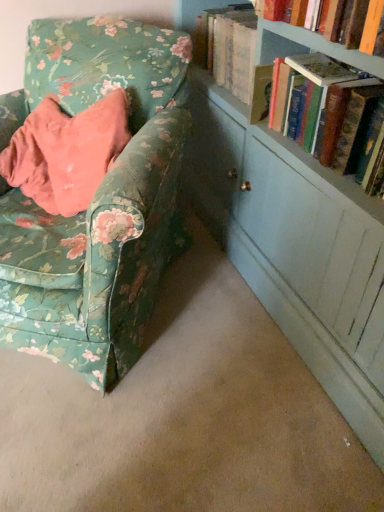
Where is `hardcover book at upper right`? hardcover book at upper right is located at coordinates (313, 100).

Describe the element at coordinates (313, 100) in the screenshot. I see `hardcover book at upper right` at that location.

Identify the location of floral fabric chair at left. Image resolution: width=384 pixels, height=512 pixels. (97, 200).

What do you see at coordinates (97, 200) in the screenshot? Image resolution: width=384 pixels, height=512 pixels. I see `floral fabric chair at left` at bounding box center [97, 200].

Where is `hardcover book at upper right`? This screenshot has width=384, height=512. hardcover book at upper right is located at coordinates (313, 100).

Which object is positioned more to the right, floral fabric chair at left or hardcover book at upper right?

hardcover book at upper right.

Who is more distant, floral fabric chair at left or hardcover book at upper right?

hardcover book at upper right is behind.

Which is in front, point (48, 214) or point (318, 126)?

The point (318, 126) is in front.

From the image's perspective, between floral fabric chair at left and hardcover book at upper right, who is located below?

floral fabric chair at left, from the image's perspective.

From a real-world perspective, is floral fabric chair at left located higher than hardcover book at upper right?

Actually, floral fabric chair at left is physically below hardcover book at upper right in the real world.

Can you confirm if floral fabric chair at left is thinner than hardcover book at upper right?

Incorrect, the width of floral fabric chair at left is not less than that of hardcover book at upper right.

In terms of height, does floral fabric chair at left look taller or shorter compared to hardcover book at upper right?

In the image, floral fabric chair at left appears to be taller than hardcover book at upper right.

Based on the photo, is floral fabric chair at left bigger or smaller than hardcover book at upper right?

Clearly, floral fabric chair at left is larger in size than hardcover book at upper right.

Based on the photo, is floral fabric chair at left inside the boundaries of hardcover book at upper right, or outside?

floral fabric chair at left is located beyond the bounds of hardcover book at upper right.

Is floral fabric chair at left touching hardcover book at upper right?

No, floral fabric chair at left is not next to hardcover book at upper right.

Is floral fabric chair at left looking in the opposite direction of hardcover book at upper right?

No, floral fabric chair at left is not facing the opposite direction of hardcover book at upper right.

What's the angular difference between floral fabric chair at left and hardcover book at upper right's facing directions?

53.4 degrees.

Measure the distance from floral fabric chair at left to hardcover book at upper right.

They are 55.91 centimeters apart.

This screenshot has width=384, height=512. Identify the location of book located above the floral fabric chair at left (from a real-world perspective). (313, 100).

Between hardcover book at upper right and floral fabric chair at left, which one appears on the left side from the viewer's perspective?

From the viewer's perspective, floral fabric chair at left appears more on the left side.

Which object is closer to the camera, hardcover book at upper right or floral fabric chair at left?

floral fabric chair at left is in front.

Does point (310, 147) appear closer or farther from the camera than point (110, 337)?

Point (310, 147) appears to be farther away from the viewer than point (110, 337).

From the image's perspective, which is below, hardcover book at upper right or floral fabric chair at left?

From the image's view, floral fabric chair at left is below.

From a real-world perspective, between hardcover book at upper right and floral fabric chair at left, who is vertically lower?

floral fabric chair at left.

In terms of width, does hardcover book at upper right look wider or thinner when compared to floral fabric chair at left?

Clearly, hardcover book at upper right has less width compared to floral fabric chair at left.

Considering the sizes of objects hardcover book at upper right and floral fabric chair at left in the image provided, who is taller, hardcover book at upper right or floral fabric chair at left?

With more height is floral fabric chair at left.

Who is bigger, hardcover book at upper right or floral fabric chair at left?

floral fabric chair at left.

Would you say hardcover book at upper right contains floral fabric chair at left?

Definitely not — floral fabric chair at left is not inside hardcover book at upper right.

Is hardcover book at upper right directly adjacent to floral fabric chair at left?

hardcover book at upper right and floral fabric chair at left are clearly separated.

Is hardcover book at upper right turned away from floral fabric chair at left?

No, hardcover book at upper right's orientation is not away from floral fabric chair at left.

How different are the orientations of hardcover book at upper right and floral fabric chair at left in degrees?

The angular difference between hardcover book at upper right and floral fabric chair at left is 53.4 degrees.

You are a GUI agent. You are given a task and a screenshot of the screen. Output one action in this format:
    pyautogui.click(x=<x>, y=<y>)
    Task: Click on the book lying above the floral fabric chair at left (from the image's perspective)
    
    Given the screenshot: What is the action you would take?
    pyautogui.click(x=313, y=100)

Identify the location of chair located in front of the hardcover book at upper right. (97, 200).

Where is `book above the floral fabric chair at left (from the image's perspective)`? Image resolution: width=384 pixels, height=512 pixels. book above the floral fabric chair at left (from the image's perspective) is located at coordinates (313, 100).